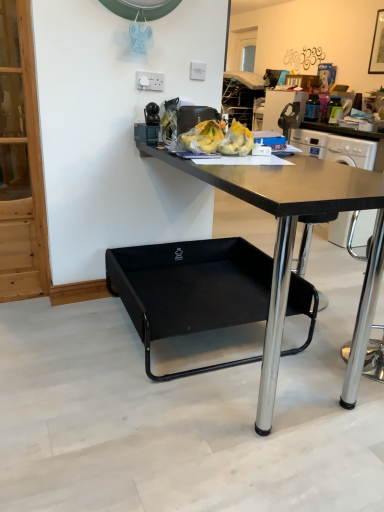
Question: Is white plastic power outlet at upper center, acting as the second power outlet starting from the left, bigger than black matte desk at center?

Choices:
 (A) yes
 (B) no

Answer: (B)

Question: Is white plastic power outlet at upper center, the 2th power outlet in the front-to-back sequence, outside of black matte desk at center?

Choices:
 (A) yes
 (B) no

Answer: (A)

Question: From the image's perspective, does white plastic power outlet at upper center, which ranks as the 1th power outlet in right-to-left order, appear higher than black matte desk at center?

Choices:
 (A) no
 (B) yes

Answer: (B)

Question: Does white plastic power outlet at upper center, acting as the second power outlet starting from the left, have a smaller size compared to black matte desk at center?

Choices:
 (A) yes
 (B) no

Answer: (A)

Question: From a real-world perspective, is white plastic power outlet at upper center, which ranks as the 1th power outlet in right-to-left order, over black matte desk at center?

Choices:
 (A) yes
 (B) no

Answer: (A)

Question: Is black glass picture frame at upper right oriented towards yellow plastic bananas at center?

Choices:
 (A) yes
 (B) no

Answer: (B)

Question: Is black glass picture frame at upper right shorter than yellow plastic bananas at center?

Choices:
 (A) yes
 (B) no

Answer: (B)

Question: Is black glass picture frame at upper right thinner than yellow plastic bananas at center?

Choices:
 (A) yes
 (B) no

Answer: (A)

Question: From the image's perspective, would you say black glass picture frame at upper right is positioned over yellow plastic bananas at center?

Choices:
 (A) no
 (B) yes

Answer: (B)

Question: Is black glass picture frame at upper right wider than yellow plastic bananas at center?

Choices:
 (A) yes
 (B) no

Answer: (B)

Question: Is black glass picture frame at upper right smaller than yellow plastic bananas at center?

Choices:
 (A) no
 (B) yes

Answer: (A)

Question: Considering the relative sizes of black glass picture frame at upper right and black matte desk at center in the image provided, is black glass picture frame at upper right wider than black matte desk at center?

Choices:
 (A) yes
 (B) no

Answer: (B)